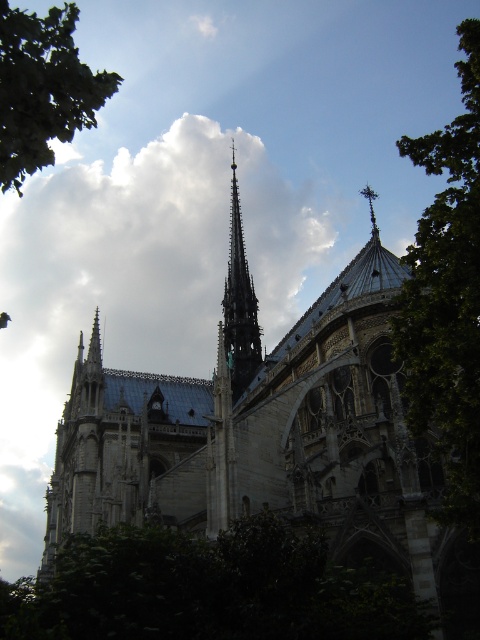
Locate an element on the screen. The image size is (480, 640). green leafy tree at upper left is located at coordinates (43, 88).

This screenshot has height=640, width=480. Find the location of `green leafy tree at upper left`. green leafy tree at upper left is located at coordinates (43, 88).

Can you confirm if white fluffy cloud at upper center is positioned below green leafy tree at lower center?

Incorrect, white fluffy cloud at upper center is not positioned below green leafy tree at lower center.

Is point (99, 276) positioned after point (144, 625)?

Yes, it is behind point (144, 625).

The width and height of the screenshot is (480, 640). What do you see at coordinates (152, 252) in the screenshot?
I see `white fluffy cloud at upper center` at bounding box center [152, 252].

At what (x,y) coordinates should I click in order to perform the action: click on white fluffy cloud at upper center. Please return your answer as a coordinate pair (x, y). This screenshot has width=480, height=640. Looking at the image, I should click on point(152,252).

Between stone gothic cathedral at center and polished silver spire at upper right, which one is positioned higher?

polished silver spire at upper right is higher up.

Who is taller, stone gothic cathedral at center or polished silver spire at upper right?

Standing taller between the two is stone gothic cathedral at center.

Between point (225, 400) and point (372, 211), which one is positioned in front?

Point (225, 400) is in front.

Locate an element on the screen. stone gothic cathedral at center is located at coordinates (271, 436).